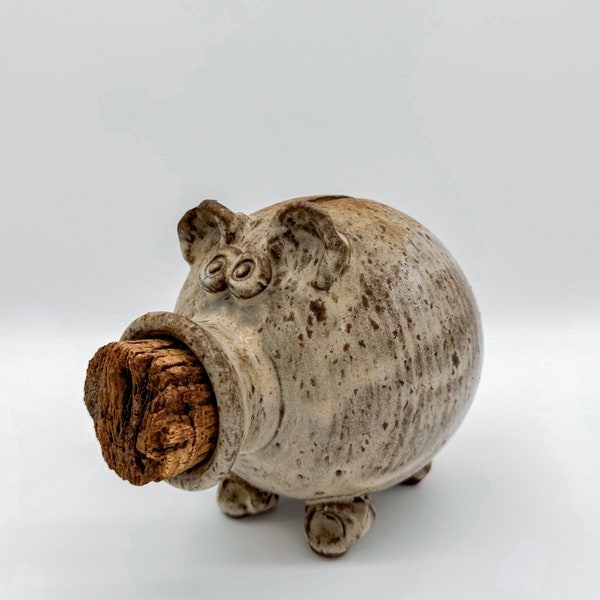
Find the location of a particular element. antiques is located at coordinates (284, 342).